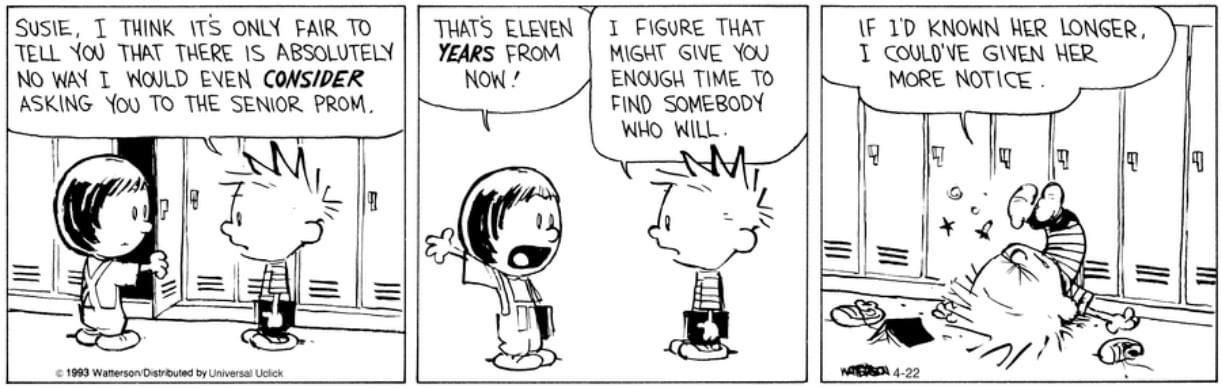
Locate an element on the screen. The width and height of the screenshot is (1221, 388). lockers is located at coordinates (1199, 221), (1166, 224), (1107, 204), (1028, 166), (967, 166), (895, 178), (845, 181).